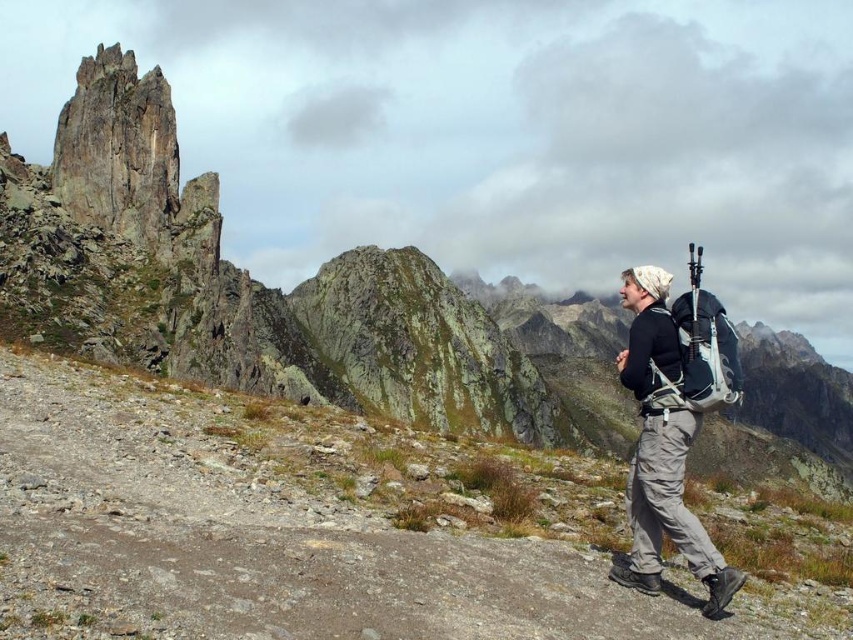
Question: Considering the relative positions of dull gray gravel at center and matte black backpack at right in the image provided, where is dull gray gravel at center located with respect to matte black backpack at right?

Choices:
 (A) left
 (B) right

Answer: (A)

Question: Does dull gray gravel at center have a lesser width compared to matte black backpack at right?

Choices:
 (A) yes
 (B) no

Answer: (B)

Question: Which of the following is the closest to the observer?

Choices:
 (A) (637, 570)
 (B) (585, 588)

Answer: (B)

Question: Which point is farther from the camera taking this photo?

Choices:
 (A) (675, 385)
 (B) (234, 477)

Answer: (B)

Question: Is dull gray gravel at center closer to the viewer compared to matte black backpack at right?

Choices:
 (A) no
 (B) yes

Answer: (B)